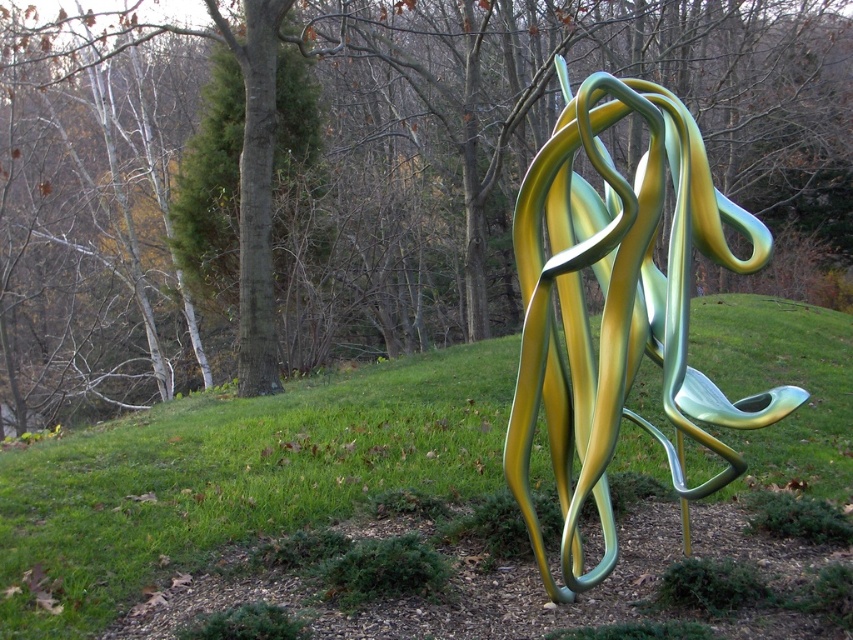
Question: Is green matte tree at center positioned behind green grass at center?

Choices:
 (A) yes
 (B) no

Answer: (A)

Question: Estimate the real-world distances between objects in this image. Which object is closer to the green matte tree at center?

Choices:
 (A) green grass at center
 (B) metallic green and yellow sculpture at center

Answer: (A)

Question: Estimate the real-world distances between objects in this image. Which object is farther from the green grass at center?

Choices:
 (A) metallic green and yellow sculpture at center
 (B) green matte tree at center

Answer: (B)

Question: Is green matte tree at center to the left of green grass at center from the viewer's perspective?

Choices:
 (A) yes
 (B) no

Answer: (A)

Question: Estimate the real-world distances between objects in this image. Which object is farther from the green grass at center?

Choices:
 (A) metallic green and yellow sculpture at center
 (B) green matte tree at center

Answer: (B)

Question: Is green grass at center below metallic green and yellow sculpture at center?

Choices:
 (A) no
 (B) yes

Answer: (B)